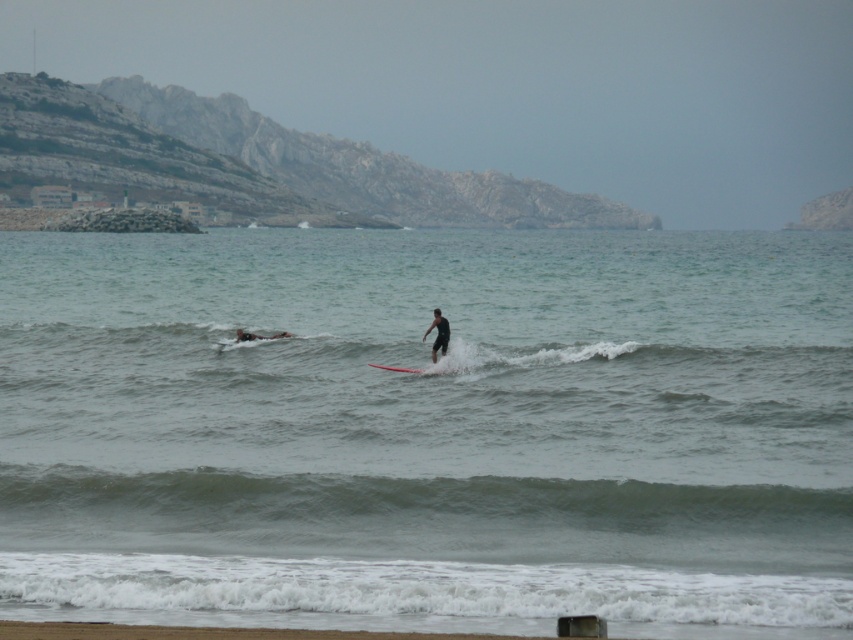
You are a photographer trying to capture the surfboard and the water in the scene. Which object, the clear water at surfboard center or the black matte surfboard at center, appears higher in the image?

The clear water at surfboard center is taller than the black matte surfboard at center, so it appears higher in the image.

You are a lifeguard on duty and see the clear water at surfboard center and the smooth red surfboard at center in the image. Which object is positioned higher from the ground level?

The clear water at surfboard center is located above the smooth red surfboard at center, so it is higher from the ground level.

You are a photographer positioned on the beach. You want to take a photo of both the black matte surfboard at center and the smooth red surfboard at center. The camera can capture objects within a 1.5 meter range. Will both surfboards fit in the photo?

The black matte surfboard at center is 1.15 meters from the smooth red surfboard at center, so yes, both surfboards will fit within the camera range of 1.5 meters.